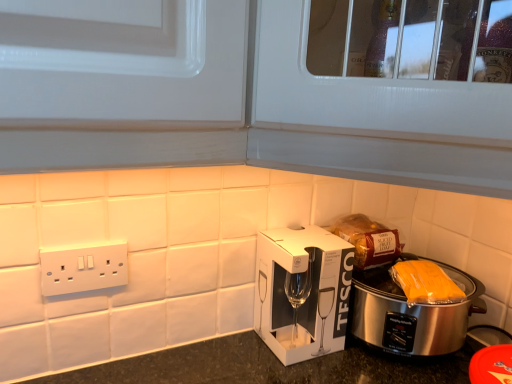
Question: Is white plastic power plugs and sockets at lower left positioned in front of yellow plastic bag at right?

Choices:
 (A) yes
 (B) no

Answer: (A)

Question: From a real-world perspective, is white plastic power plugs and sockets at lower left below yellow plastic bag at right?

Choices:
 (A) yes
 (B) no

Answer: (B)

Question: Is white plastic power plugs and sockets at lower left far from yellow plastic bag at right?

Choices:
 (A) yes
 (B) no

Answer: (B)

Question: Can you confirm if white plastic power plugs and sockets at lower left is smaller than yellow plastic bag at right?

Choices:
 (A) yes
 (B) no

Answer: (A)

Question: Does white plastic power plugs and sockets at lower left appear on the left side of yellow plastic bag at right?

Choices:
 (A) yes
 (B) no

Answer: (A)

Question: Could you tell me if white plastic power plugs and sockets at lower left is facing yellow plastic bag at right?

Choices:
 (A) yes
 (B) no

Answer: (B)

Question: Is yellow plastic bag at right further to camera compared to white cardboard box at center?

Choices:
 (A) yes
 (B) no

Answer: (B)

Question: From a real-world perspective, is yellow plastic bag at right on top of white cardboard box at center?

Choices:
 (A) no
 (B) yes

Answer: (B)

Question: From the image's perspective, is yellow plastic bag at right beneath white cardboard box at center?

Choices:
 (A) yes
 (B) no

Answer: (B)

Question: Does yellow plastic bag at right have a smaller size compared to white cardboard box at center?

Choices:
 (A) no
 (B) yes

Answer: (B)

Question: Is yellow plastic bag at right next to white cardboard box at center and touching it?

Choices:
 (A) no
 (B) yes

Answer: (A)

Question: Is white cardboard box at center inside yellow plastic bag at right?

Choices:
 (A) yes
 (B) no

Answer: (B)

Question: Does silver metallic slow cooker at lower right have a greater width compared to white textured cabinet at upper center?

Choices:
 (A) yes
 (B) no

Answer: (B)